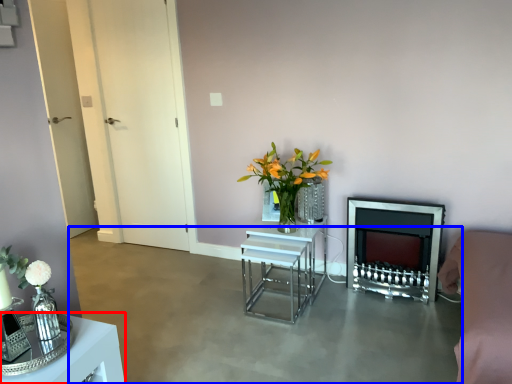
Question: Among these objects, which one is nearest to the camera, table (highlighted by a red box) or concrete (highlighted by a blue box)?

Choices:
 (A) table
 (B) concrete

Answer: (A)